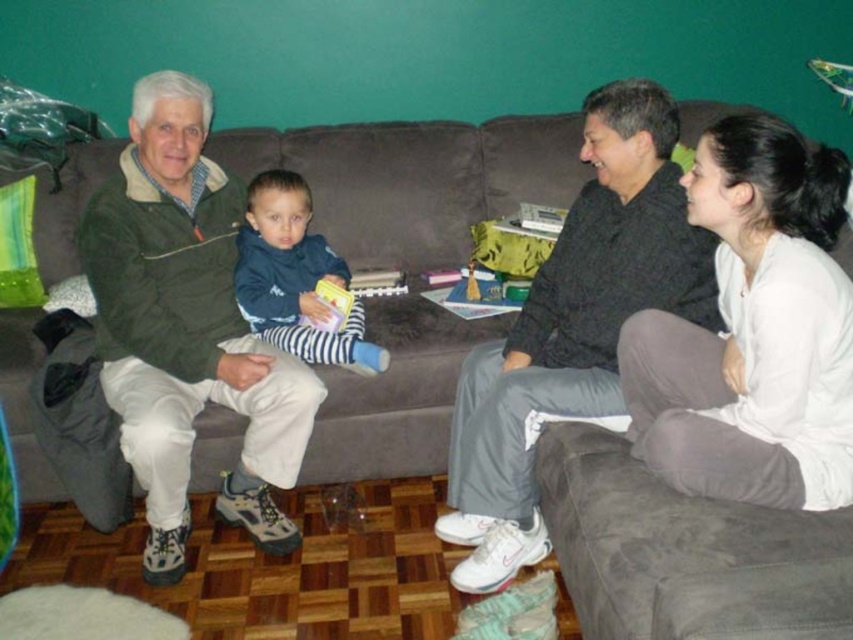
Measure the distance from white soft sweater at lower right to green textured jacket at left.

white soft sweater at lower right is 1.08 meters away from green textured jacket at left.

Is white soft sweater at lower right taller than green textured jacket at left?

Incorrect, white soft sweater at lower right's height is not larger of green textured jacket at left's.

Does point (747, 296) come farther from viewer compared to point (270, 502)?

No, it is in front of (270, 502).

Where is `white soft sweater at lower right`? Image resolution: width=853 pixels, height=640 pixels. white soft sweater at lower right is located at coordinates (753, 332).

Is green textured jacket at left smaller than blue striped pants at center?

Actually, green textured jacket at left might be larger than blue striped pants at center.

In the scene shown: Is green textured jacket at left to the left of blue striped pants at center from the viewer's perspective?

Correct, you'll find green textured jacket at left to the left of blue striped pants at center.

Is point (129, 122) behind point (302, 275)?

No, (129, 122) is in front of (302, 275).

At what (x,y) coordinates should I click in order to perform the action: click on green textured jacket at left. Please return your answer as a coordinate pair (x, y). Looking at the image, I should click on click(186, 326).

Does green textured jacket at left have a smaller size compared to dark gray pants at right?

No, green textured jacket at left is not smaller than dark gray pants at right.

Does green textured jacket at left appear under dark gray pants at right?

No, green textured jacket at left is not below dark gray pants at right.

Between point (196, 189) and point (584, 419), which one is positioned behind?

Positioned behind is point (196, 189).

At what (x,y) coordinates should I click in order to perform the action: click on green textured jacket at left. Please return your answer as a coordinate pair (x, y). The image size is (853, 640). Looking at the image, I should click on (186, 326).